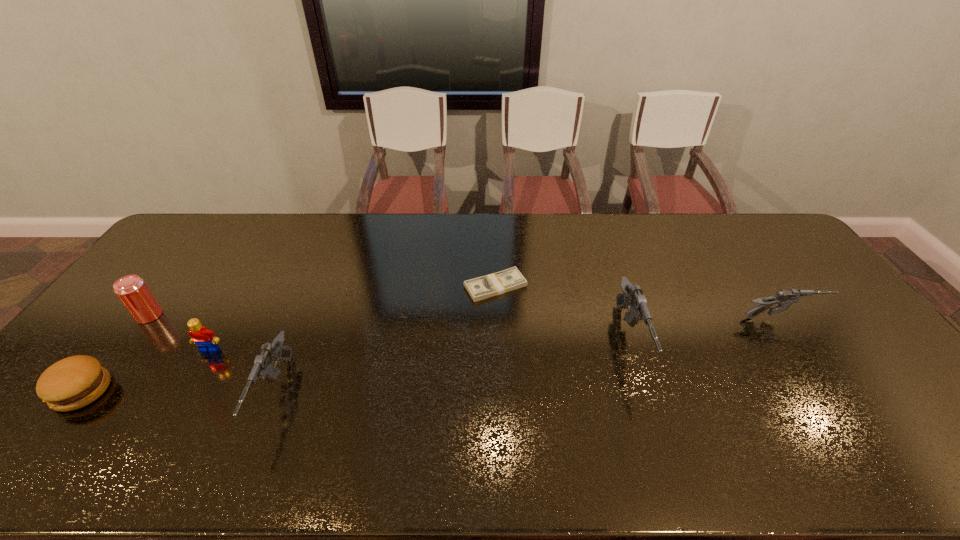
The image size is (960, 540). What are the coordinates of `the fourth object from right to left` in the screenshot? It's located at coord(263,369).

The height and width of the screenshot is (540, 960). I want to click on the leftmost gun, so click(263, 369).

Where is `the second gun from right to left`? This screenshot has height=540, width=960. the second gun from right to left is located at coordinates (632, 296).

You are a GUI agent. You are given a task and a screenshot of the screen. Output one action in this format:
    pyautogui.click(x=<x>, y=<y>)
    Task: Click on the rightmost gun
    The image size is (960, 540).
    Given the screenshot: What is the action you would take?
    pyautogui.click(x=784, y=298)

Locate an element on the screen. This screenshot has height=540, width=960. the shortest gun is located at coordinates (784, 298).

I want to click on the fifth object from left to right, so click(484, 287).

Where is `dollar`? dollar is located at coordinates (484, 287).

You are a GUI agent. You are given a task and a screenshot of the screen. Output one action in this format:
    pyautogui.click(x=<x>, y=<y>)
    Task: Click on the Lego
    Image resolution: width=960 pixels, height=540 pixels.
    Given the screenshot: What is the action you would take?
    pyautogui.click(x=205, y=339)

Image resolution: width=960 pixels, height=540 pixels. In order to click on beer can in this screenshot , I will do tap(132, 291).

You are a GUI agent. You are given a task and a screenshot of the screen. Output one action in this format:
    pyautogui.click(x=<x>, y=<y>)
    Task: Click on the second shortest object
    The image size is (960, 540).
    Given the screenshot: What is the action you would take?
    pyautogui.click(x=74, y=382)